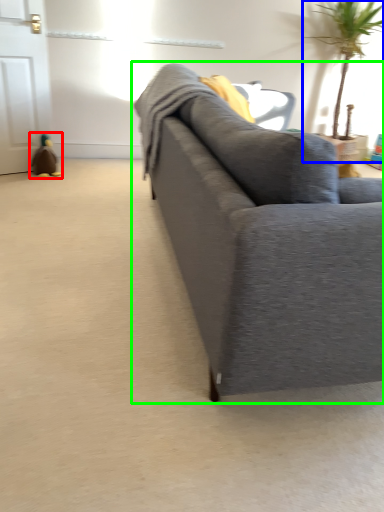
Question: Which object is the closest to the toy (highlighted by a red box)? Choose among these: houseplant (highlighted by a blue box) or studio couch (highlighted by a green box).

Choices:
 (A) houseplant
 (B) studio couch

Answer: (B)